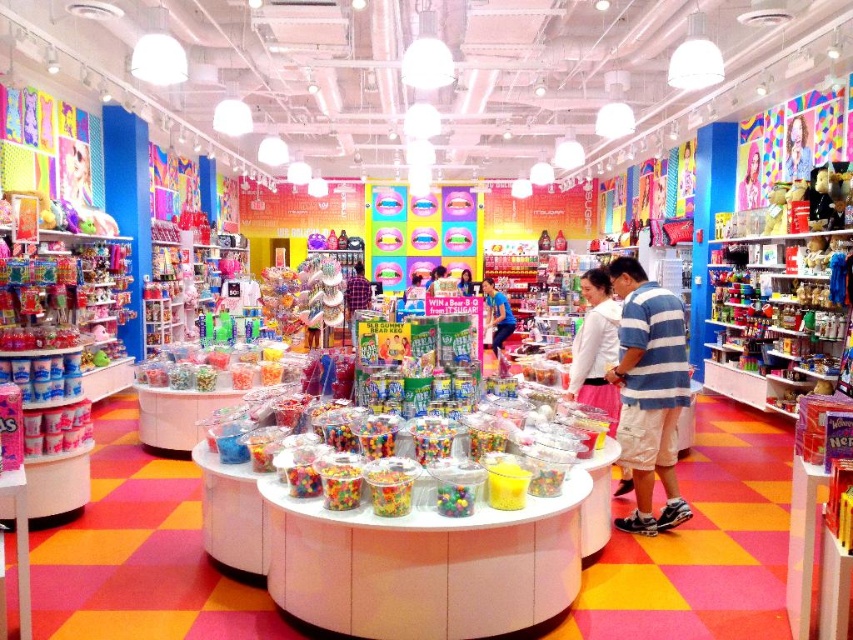
Question: Which point is farther from the camera taking this photo?

Choices:
 (A) (x=798, y=150)
 (B) (x=463, y=276)
 (C) (x=648, y=404)
 (D) (x=430, y=291)

Answer: (B)

Question: Can you confirm if blue fabric shirt at center is wider than matte blue shirt at center?

Choices:
 (A) yes
 (B) no

Answer: (B)

Question: Does smooth plastic toy at center appear under smooth pink dress at center?

Choices:
 (A) no
 (B) yes

Answer: (A)

Question: Can you confirm if striped cotton shirt at center is wider than smooth pink dress at center?

Choices:
 (A) no
 (B) yes

Answer: (B)

Question: Among these points, which one is nearest to the camera?

Choices:
 (A) (807, 115)
 (B) (683, 340)
 (C) (492, 296)
 (D) (444, 275)

Answer: (B)

Question: Which object appears farthest from the camera in this image?

Choices:
 (A) smooth pink dress at center
 (B) matte blue shirt at center
 (C) blue fabric shirt at center
 (D) smooth plastic toy at center

Answer: (A)